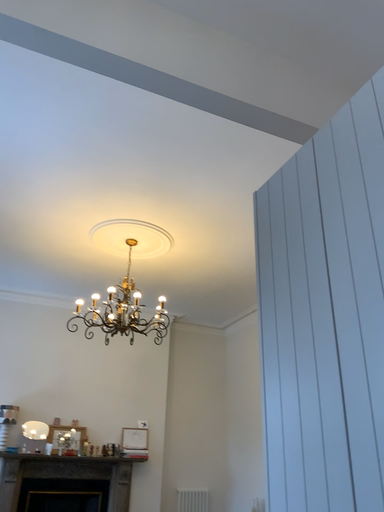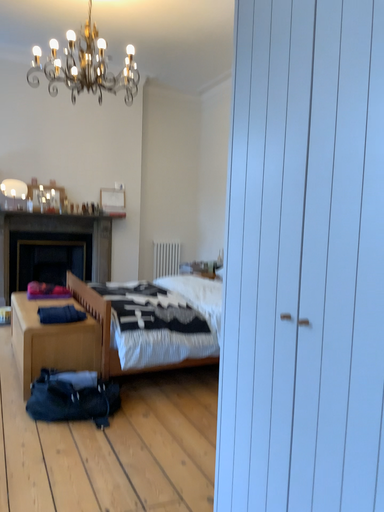
Question: Which way did the camera rotate in the video?

Choices:
 (A) rotated upward
 (B) rotated downward

Answer: (B)